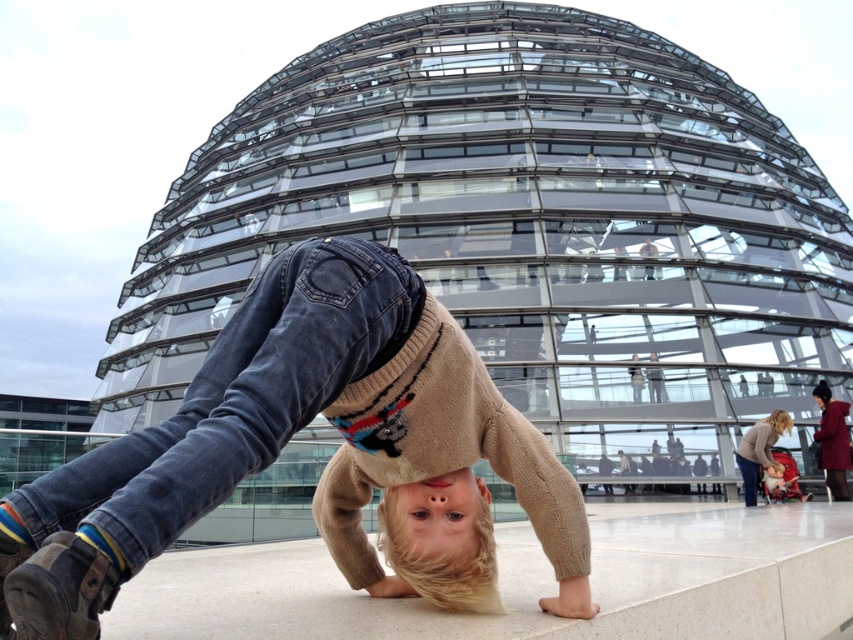
Question: Which of these objects is positioned farthest from the knitted sweater at center?

Choices:
 (A) blonde hair at center
 (B) light brown sweater at lower right

Answer: (B)

Question: Among these points, which one is farthest from the camera?

Choices:
 (A) (195, 387)
 (B) (744, 477)
 (C) (409, 557)

Answer: (B)

Question: Does knitted sweater at center have a smaller size compared to blonde hair at center?

Choices:
 (A) no
 (B) yes

Answer: (A)

Question: Which of these objects is positioned closest to the light brown sweater at lower right?

Choices:
 (A) blonde hair at center
 (B) knitted sweater at center

Answer: (A)

Question: Is knitted sweater at center above blonde hair at center?

Choices:
 (A) yes
 (B) no

Answer: (A)

Question: Can you confirm if knitted sweater at center is bigger than light brown sweater at lower right?

Choices:
 (A) no
 (B) yes

Answer: (B)